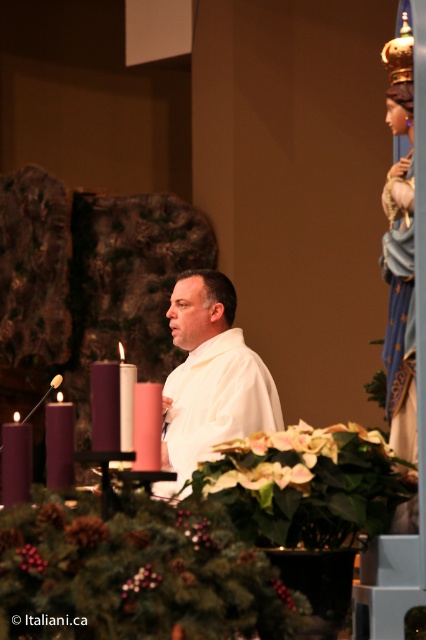
Question: Among these points, which one is nearest to the camera?

Choices:
 (A) (118, 388)
 (B) (233, 308)

Answer: (A)

Question: Can you confirm if matte white candle at left is thinner than pink wax candle at center?

Choices:
 (A) yes
 (B) no

Answer: (A)

Question: Is matte white candle at left thinner than purple matte candle at left?

Choices:
 (A) yes
 (B) no

Answer: (A)

Question: Is white matte/soft fabric at center above pink wax candle at center?

Choices:
 (A) no
 (B) yes

Answer: (A)

Question: Among these points, which one is farthest from the camera?

Choices:
 (A) (31, 476)
 (B) (149, 445)

Answer: (B)

Question: Which point appears farthest from the camera in this image?

Choices:
 (A) (48, 461)
 (B) (189, 326)
 (C) (120, 387)
 (D) (8, 502)

Answer: (B)